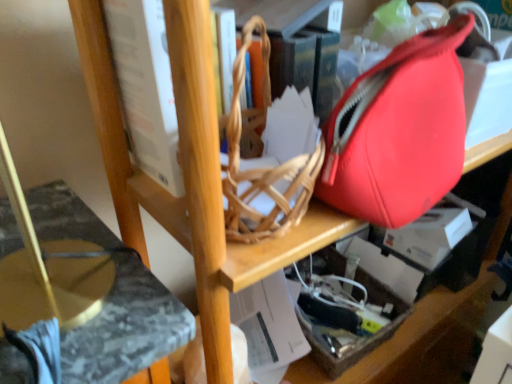
Question: Considering the relative sizes of marble-patterned swivel chair at lower left and translucent plastic box at lower right in the image provided, is marble-patterned swivel chair at lower left shorter than translucent plastic box at lower right?

Choices:
 (A) yes
 (B) no

Answer: (B)

Question: Considering the relative positions of marble-patterned swivel chair at lower left and translucent plastic box at lower right in the image provided, is marble-patterned swivel chair at lower left to the right of translucent plastic box at lower right from the viewer's perspective?

Choices:
 (A) yes
 (B) no

Answer: (B)

Question: Is marble-patterned swivel chair at lower left facing towards translucent plastic box at lower right?

Choices:
 (A) no
 (B) yes

Answer: (A)

Question: Considering the relative sizes of marble-patterned swivel chair at lower left and translucent plastic box at lower right in the image provided, is marble-patterned swivel chair at lower left taller than translucent plastic box at lower right?

Choices:
 (A) yes
 (B) no

Answer: (A)

Question: Would you say translucent plastic box at lower right is part of marble-patterned swivel chair at lower left's contents?

Choices:
 (A) no
 (B) yes

Answer: (A)

Question: Is marble-patterned swivel chair at lower left in contact with translucent plastic box at lower right?

Choices:
 (A) yes
 (B) no

Answer: (B)

Question: Considering the relative sizes of white paperboard book at upper center and marble-patterned swivel chair at lower left in the image provided, is white paperboard book at upper center bigger than marble-patterned swivel chair at lower left?

Choices:
 (A) yes
 (B) no

Answer: (B)

Question: From the image's perspective, would you say white paperboard book at upper center is shown under marble-patterned swivel chair at lower left?

Choices:
 (A) yes
 (B) no

Answer: (B)

Question: Is white paperboard book at upper center outside marble-patterned swivel chair at lower left?

Choices:
 (A) no
 (B) yes

Answer: (B)

Question: Is white paperboard book at upper center positioned far away from marble-patterned swivel chair at lower left?

Choices:
 (A) no
 (B) yes

Answer: (A)

Question: Is marble-patterned swivel chair at lower left completely or partially inside white paperboard book at upper center?

Choices:
 (A) yes
 (B) no

Answer: (B)

Question: Considering the relative sizes of white paperboard book at upper center and marble-patterned swivel chair at lower left in the image provided, is white paperboard book at upper center shorter than marble-patterned swivel chair at lower left?

Choices:
 (A) yes
 (B) no

Answer: (A)

Question: From a real-world perspective, is translucent plastic box at lower right under marble-patterned swivel chair at lower left?

Choices:
 (A) no
 (B) yes

Answer: (B)